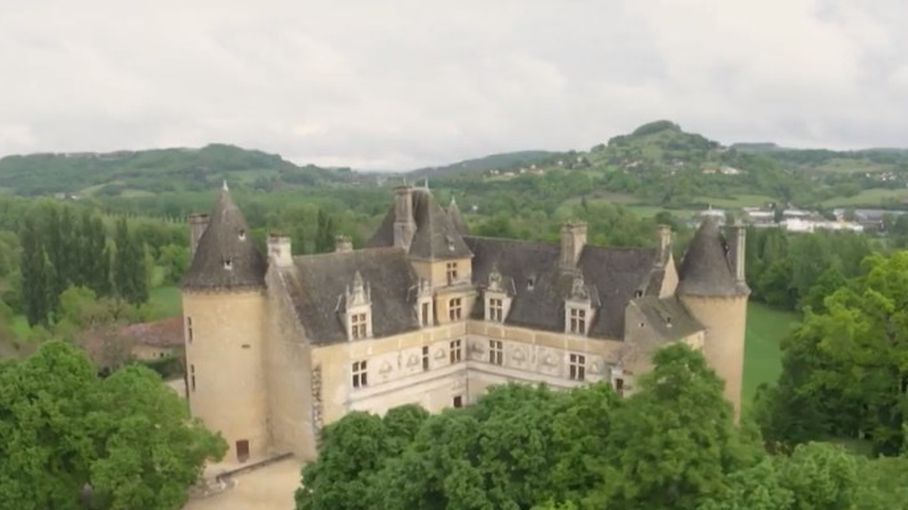
Image resolution: width=908 pixels, height=510 pixels. Identify the location of door. (238, 448), (457, 399).